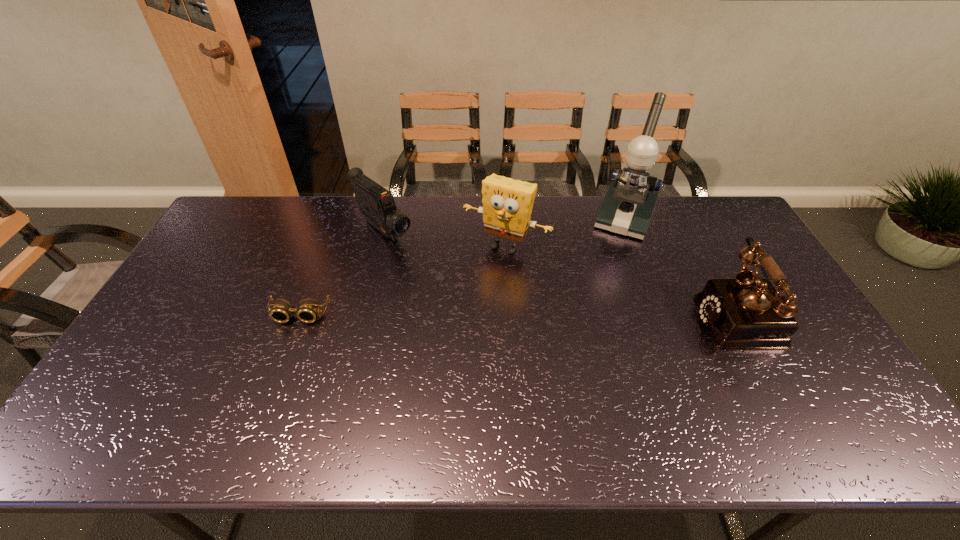
At what (x,y) coordinates should I click in order to perform the action: click on vacant area that lies between the tallest object and the goggles. Please return your answer as a coordinate pair (x, y). Looking at the image, I should click on (462, 267).

Identify the location of free space between the sponge and the goggles. (402, 281).

This screenshot has width=960, height=540. I want to click on vacant region between the sponge and the tallest object, so click(x=564, y=232).

Image resolution: width=960 pixels, height=540 pixels. In order to click on vacant space that is in between the third object from right to left and the tallest object in this screenshot , I will do `click(564, 232)`.

Locate an element on the screen. empty space between the goggles and the telephone is located at coordinates (520, 315).

At what (x,y) coordinates should I click in order to perform the action: click on the fourth closest object relative to the telephone. Please return your answer as a coordinate pair (x, y). The height and width of the screenshot is (540, 960). Looking at the image, I should click on (308, 309).

This screenshot has width=960, height=540. I want to click on the closest object to the shortest object, so click(376, 203).

The image size is (960, 540). Find the location of `vacant point that satisfies the following two spatial constraints: 1. on the front side of the sponge; 2. on the dial of the telephone`. vacant point that satisfies the following two spatial constraints: 1. on the front side of the sponge; 2. on the dial of the telephone is located at coordinates (510, 315).

Identify the location of vacant position in the image that satisfies the following two spatial constraints: 1. on the front side of the tallest object; 2. on the dial of the telephone. This screenshot has width=960, height=540. (661, 315).

Identify the location of free spot that satisfies the following two spatial constraints: 1. on the front side of the camcorder; 2. on the dial of the telephone. (364, 315).